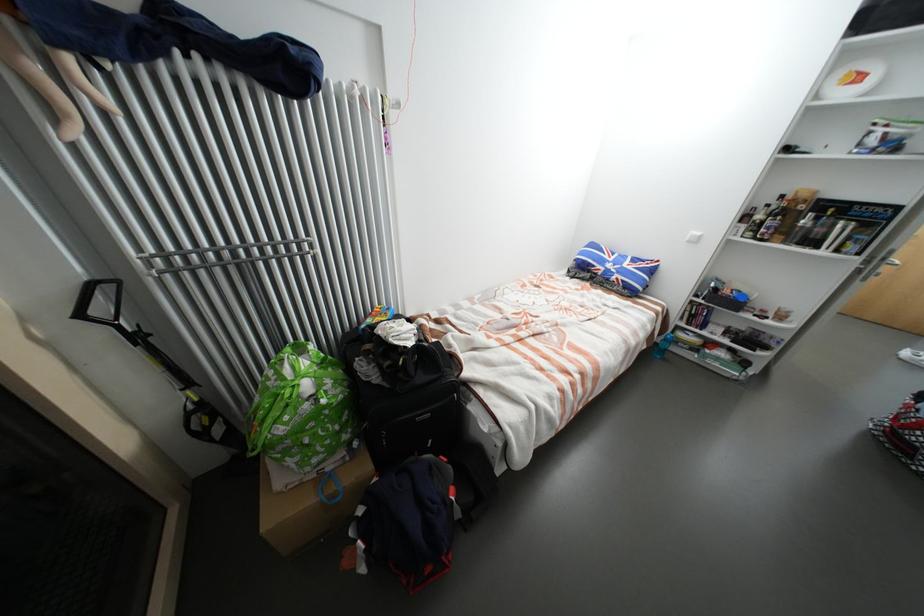
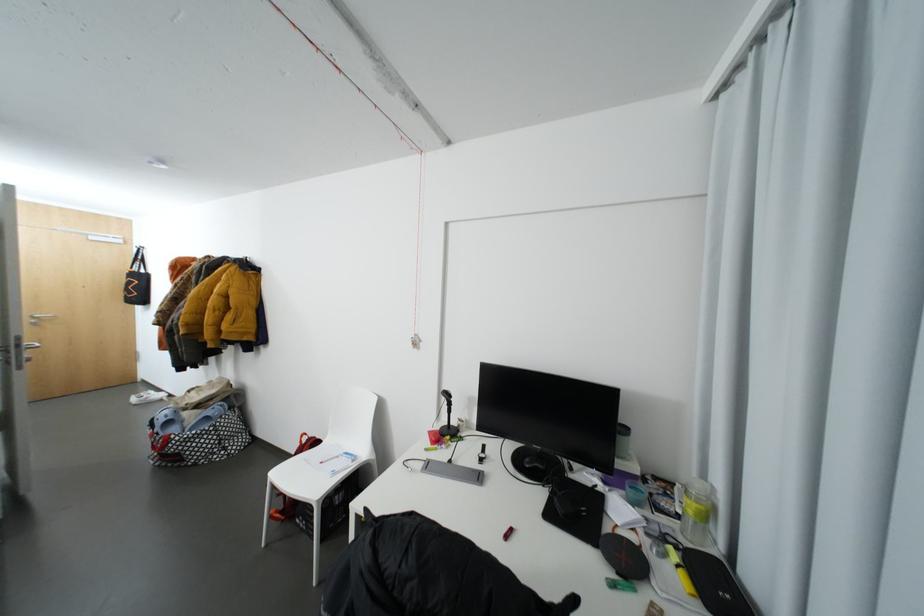
First-person continuous shooting, in which direction is the camera rotating?

The camera rotated toward right-down.